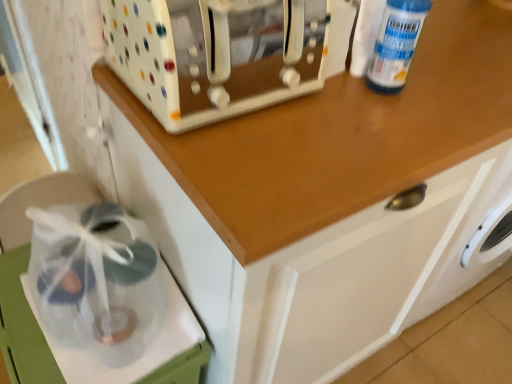
Question: Is white glossy toaster at upper center spatially inside clear plastic bag at lower left, or outside of it?

Choices:
 (A) inside
 (B) outside

Answer: (B)

Question: Based on their sizes in the image, would you say white glossy toaster at upper center is bigger or smaller than clear plastic bag at lower left?

Choices:
 (A) big
 (B) small

Answer: (A)

Question: Considering the real-world distances, which object is closest to the clear plastic bottle at upper right?

Choices:
 (A) white glossy toaster at upper center
 (B) clear plastic bag at lower left

Answer: (A)

Question: Which object is positioned farthest from the clear plastic bag at lower left?

Choices:
 (A) white glossy toaster at upper center
 (B) clear plastic bottle at upper right

Answer: (B)